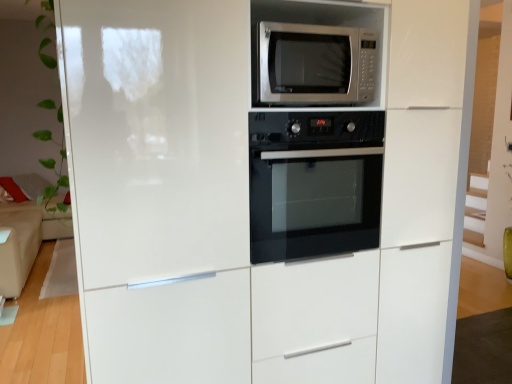
Question: Is satin silver microwave at upper center bigger or smaller than black glass oven at center?

Choices:
 (A) big
 (B) small

Answer: (B)

Question: From the image's perspective, relative to black glass oven at center, is satin silver microwave at upper center above or below?

Choices:
 (A) below
 (B) above

Answer: (B)

Question: Considering the real-world distances, which object is farthest from the beige fabric couch at left?

Choices:
 (A) satin silver microwave at upper center
 (B) black glass oven at center

Answer: (A)

Question: Based on their relative distances, which object is farther from the satin silver microwave at upper center?

Choices:
 (A) black glass oven at center
 (B) beige fabric couch at left

Answer: (B)